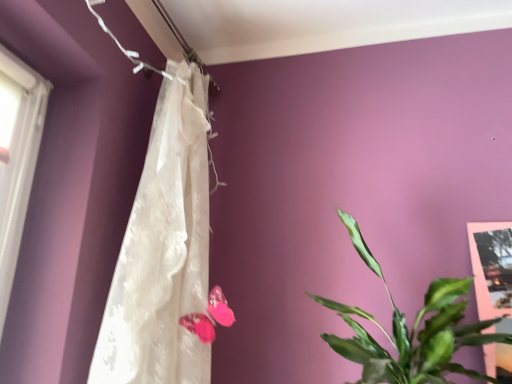
Question: From a real-world perspective, is white lace curtain at upper center physically located above or below green leafy plant at right?

Choices:
 (A) above
 (B) below

Answer: (A)

Question: Considering the positions of white lace curtain at upper center and green leafy plant at right in the image, is white lace curtain at upper center wider or thinner than green leafy plant at right?

Choices:
 (A) thin
 (B) wide

Answer: (A)

Question: Estimate the real-world distances between objects in this image. Which object is farther from the white lace curtain at upper center?

Choices:
 (A) pink fabric butterfly at center
 (B) green leafy plant at right

Answer: (B)

Question: Considering the real-world distances, which object is farthest from the green leafy plant at right?

Choices:
 (A) pink fabric butterfly at center
 (B) white lace curtain at upper center

Answer: (B)